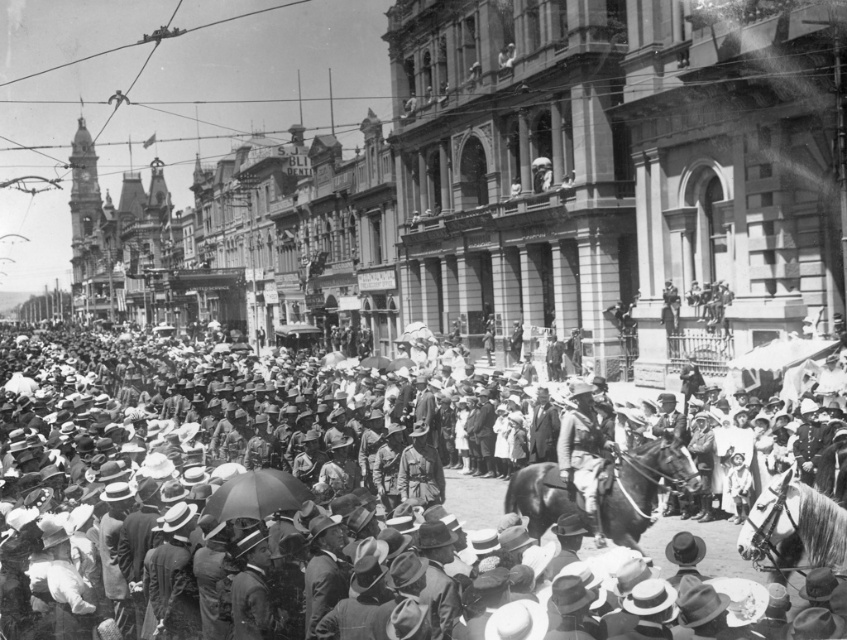
Between shiny brown horse at lower right and camouflage fabric uniform at center, which one is positioned lower?

shiny brown horse at lower right

Is shiny brown horse at lower right bigger than camouflage fabric uniform at center?

No.

Who is more distant from viewer, (x=839, y=524) or (x=571, y=442)?

The point (x=571, y=442) is more distant.

Image resolution: width=847 pixels, height=640 pixels. I want to click on shiny brown horse at lower right, so click(793, 529).

Which is behind, point (268, 556) or point (555, 515)?

The point (555, 515) is more distant.

This screenshot has width=847, height=640. Identify the location of matte black crowd at center. (192, 481).

Who is higher up, matte black crowd at center or camouflage fabric uniform at center?

camouflage fabric uniform at center

Is point (475, 420) farther from viewer compared to point (574, 403)?

Yes, point (475, 420) is farther from viewer.

Which is behind, point (585, 625) or point (573, 461)?

Point (573, 461)

Locate an element on the screen. matte black crowd at center is located at coordinates (192, 481).